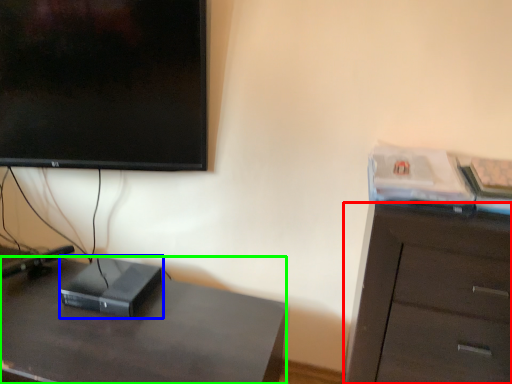
Question: Estimate the real-world distances between objects in this image. Which object is farther from cabinetry (highlighted by a red box), computer (highlighted by a blue box) or desk (highlighted by a green box)?

Choices:
 (A) computer
 (B) desk

Answer: (A)